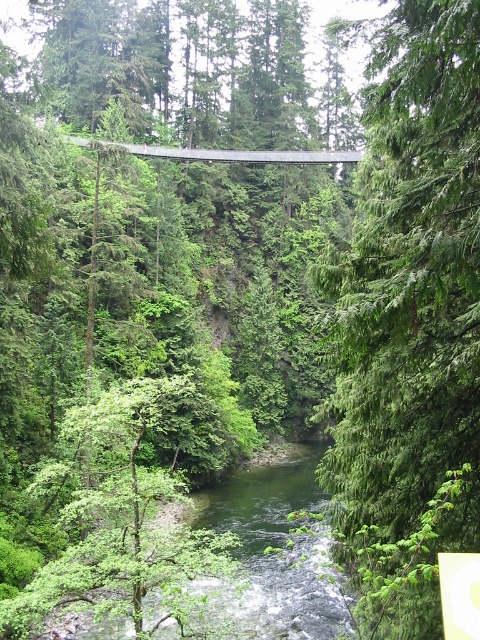
You are a hiker standing on the suspension bridge in the forest. You notice a green matte tree at upper center and a green leafy stream at center. Which object is taller?

The green matte tree at upper center is taller than the green leafy stream at center.

You are standing on the suspension bridge in the forest and want to locate the green matte tree at upper center. According to the coordinates provided, where should you look relative to the bridge?

The green matte tree at upper center is located at coordinates point [408,323], which is above and slightly to the right of the suspension bridge.